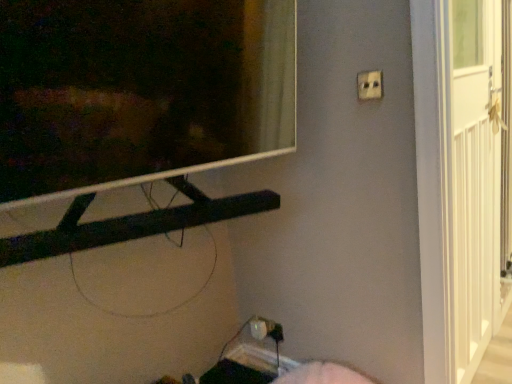
In order to click on white plastic electric outlet at upper right in this screenshot , I will do `click(370, 85)`.

This screenshot has height=384, width=512. Describe the element at coordinates (370, 85) in the screenshot. I see `white plastic electric outlet at upper right` at that location.

Image resolution: width=512 pixels, height=384 pixels. In order to click on white plastic electric outlet at upper right in this screenshot , I will do `click(370, 85)`.